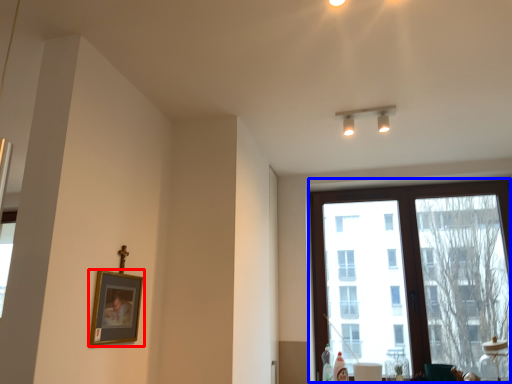
Question: Which point is further to the camera, picture frame (highlighted by a red box) or window (highlighted by a blue box)?

Choices:
 (A) picture frame
 (B) window

Answer: (B)